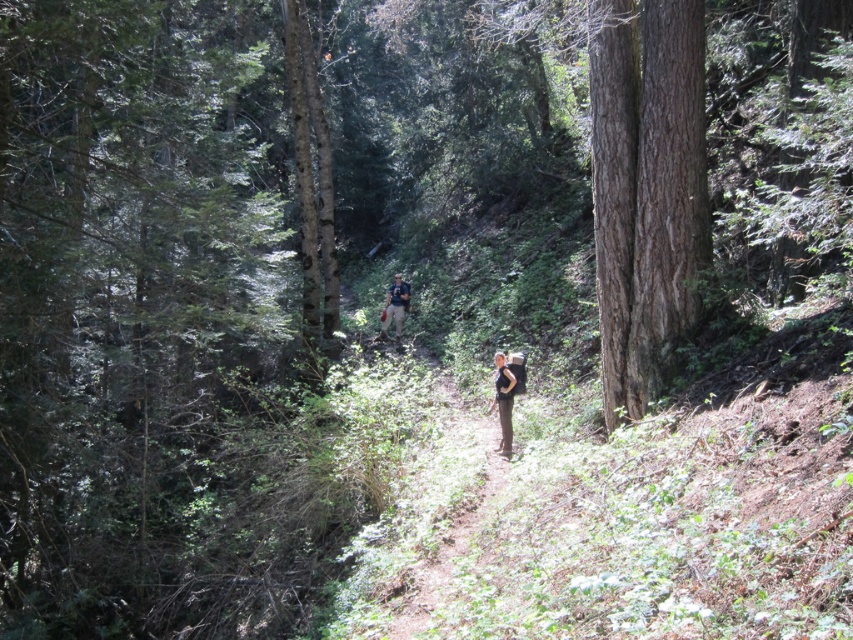
Who is taller, smooth bark tree at center or dark brown leather pants at center?

dark brown leather pants at center is taller.

Is smooth bark tree at center above dark brown leather pants at center?

Yes.

Which is behind, point (314, 243) or point (509, 438)?

The point (314, 243) is behind.

You are a GUI agent. You are given a task and a screenshot of the screen. Output one action in this format:
    pyautogui.click(x=<x>, y=<y>)
    Task: Click on the smooth bark tree at center
    The image size is (853, 640).
    Given the screenshot: What is the action you would take?
    pyautogui.click(x=311, y=186)

Can you confirm if smooth bark tree at center is positioned above camouflage fabric backpack at center?

Yes, smooth bark tree at center is above camouflage fabric backpack at center.

Can you confirm if smooth bark tree at center is positioned to the right of camouflage fabric backpack at center?

No, smooth bark tree at center is not to the right of camouflage fabric backpack at center.

Is point (306, 60) more distant than point (389, 300)?

No.

This screenshot has height=640, width=853. Identify the location of smooth bark tree at center. (311, 186).

Locate an element on the screen. Image resolution: width=853 pixels, height=640 pixels. dark brown leather pants at center is located at coordinates (503, 401).

Is point (509, 445) positioned behind point (392, 307)?

No, (509, 445) is in front of (392, 307).

Between point (503, 362) and point (396, 332), which one is positioned behind?

The point (396, 332) is more distant.

In order to click on dark brown leather pants at center in this screenshot , I will do `click(503, 401)`.